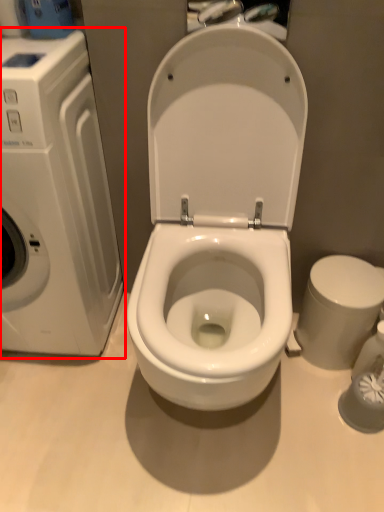
Question: From the image's perspective, what is the correct spatial positioning of washing machine (annotated by the red box) in reference to bidet?

Choices:
 (A) below
 (B) above

Answer: (B)